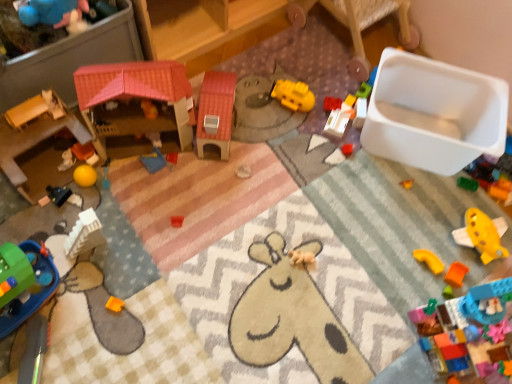
Find the location of a particular element. The width and height of the screenshot is (512, 384). space that is in front of plastic pink house at center, positioned as the 9th toy in right-to-left order is located at coordinates (159, 217).